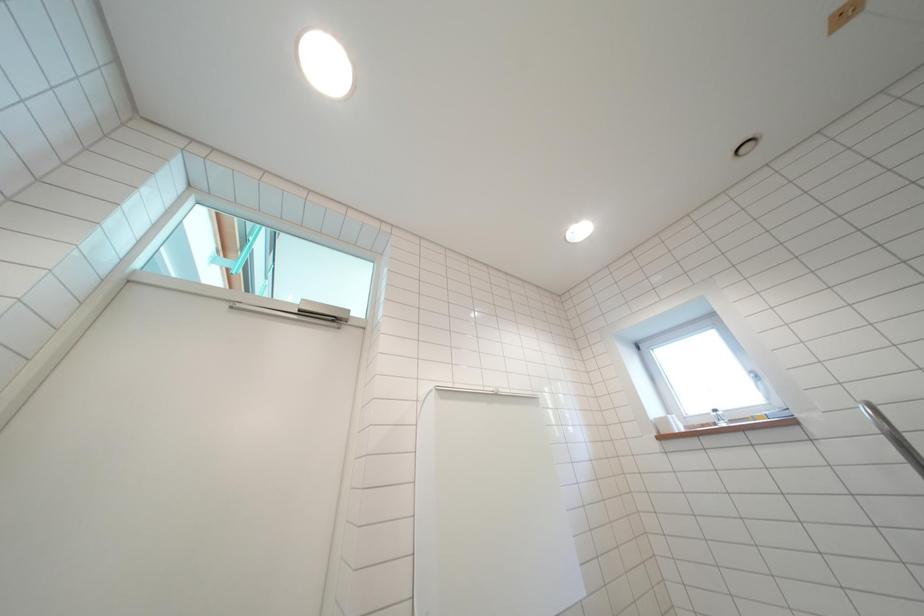
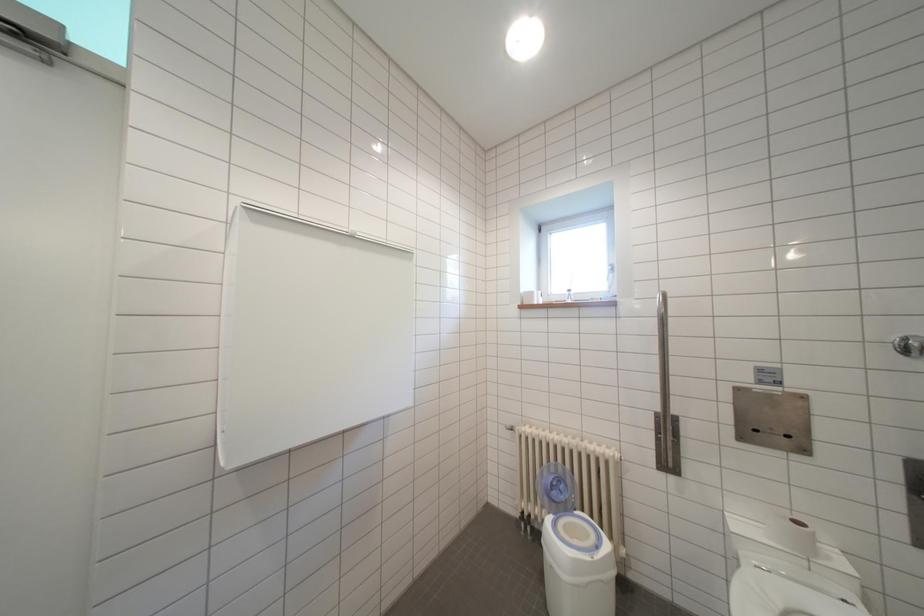
How did the camera likely rotate?

The camera rotated toward right-down.